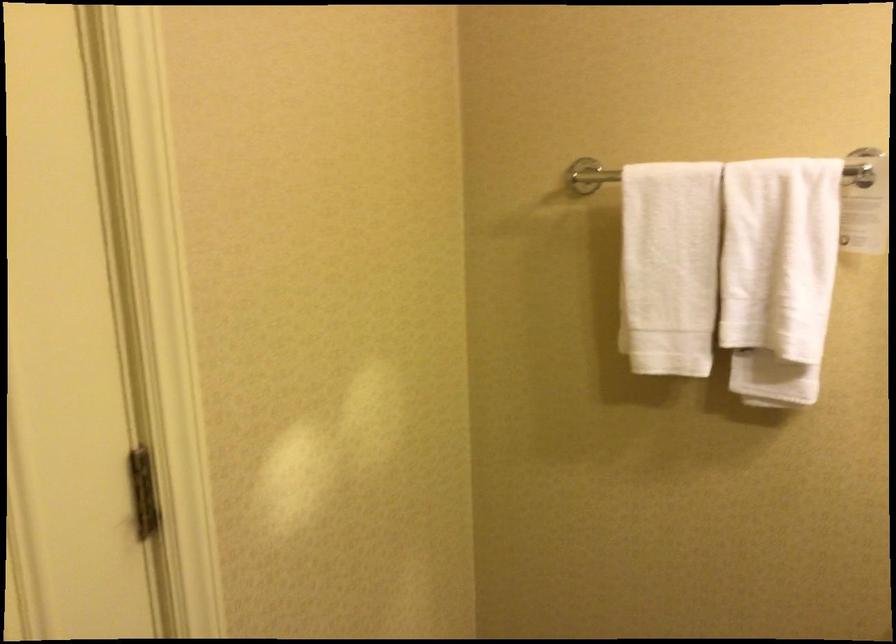
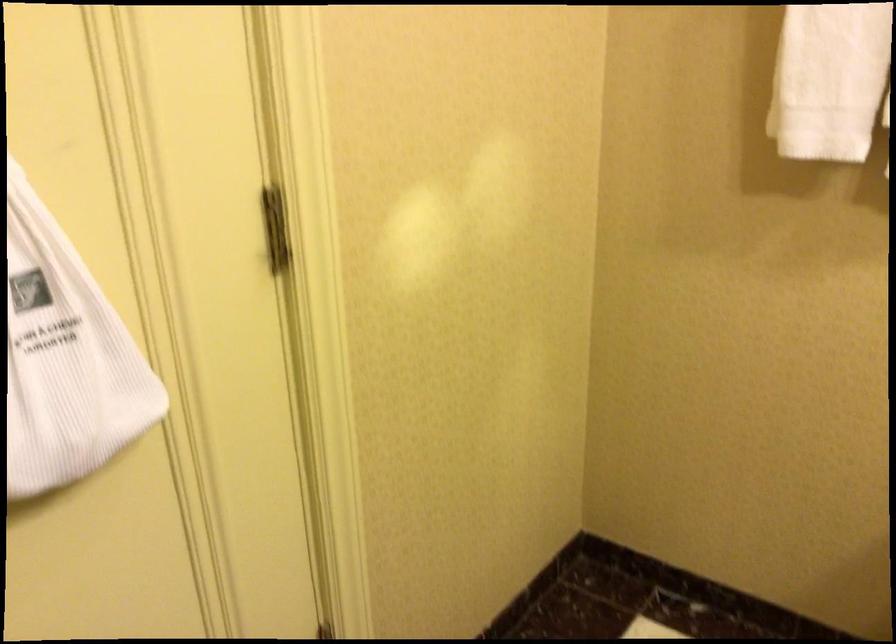
Question: The images are taken continuously from a first-person perspective. In which direction is your viewpoint rotating?

Choices:
 (A) Left
 (B) Right
 (C) Up
 (D) Down

Answer: (D)